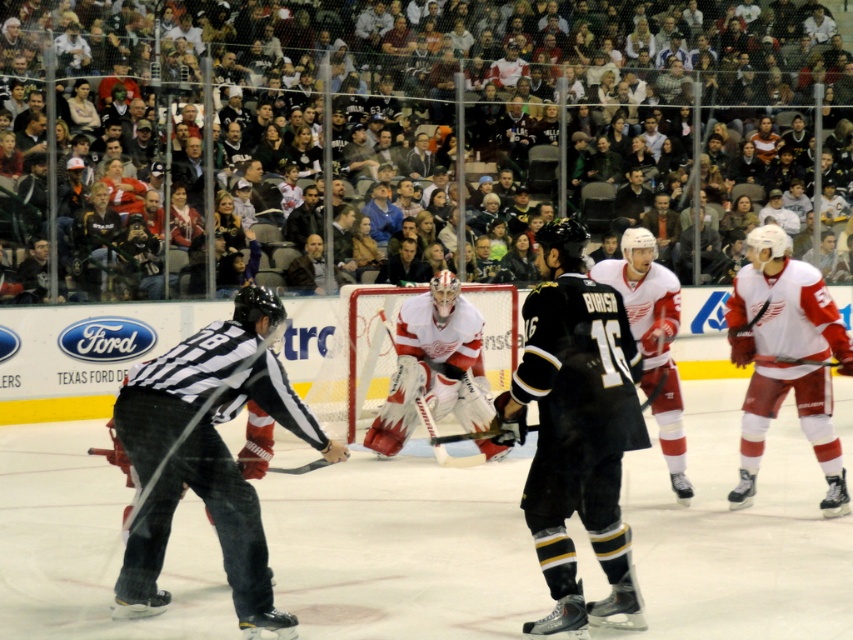
Based on the scene description, where is the white jersey at center located in terms of coordinates?

The white jersey at center is located at coordinates point [209,454].

You are an ice hockey coach analyzing a play. You notice two white jerseys in the arena. The one at center and the one at right. Given that the minimum passing distance for a safe pass is 15 feet, can the player in the white jersey at center make a safe pass to the white jersey at right?

The white jersey at center is 14.96 feet from the white jersey at right. Since the distance is slightly less than the required 15 feet, the player in the white jersey at center cannot make a safe pass to the white jersey at right.

You are an ice hockey player trying to pass the puck to your teammate. You see two points marked in the arena. The first point is at coordinates point (437,310) and the second point is at point (270,468). Which point is closer to you, the player?

Point (437,310) is closer to you because it is further to the viewer than point (270,468).